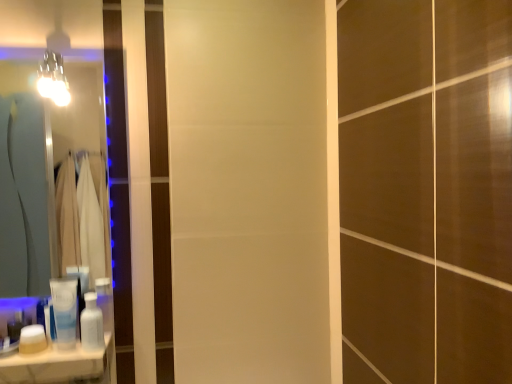
Question: From their relative heights in the image, would you say white glossy lotion at lower left, which is the second toiletry from right to left, is taller or shorter than white matte jar at lower left, marked as the first toiletry in a left-to-right arrangement?

Choices:
 (A) tall
 (B) short

Answer: (A)

Question: Which is correct: white glossy lotion at lower left, which is the second toiletry from right to left, is inside white matte jar at lower left, positioned as the third toiletry in right-to-left order, or outside of it?

Choices:
 (A) outside
 (B) inside

Answer: (A)

Question: Which object is positioned closest to the white glossy counter top at lower left?

Choices:
 (A) white glossy lotion at lower left, placed as the 2th toiletry when sorted from left to right
 (B) matte glass mirror at left
 (C) white glossy bottle at lower left, the first toiletry viewed from the right
 (D) white matte jar at lower left, positioned as the third toiletry in right-to-left order
 (E) metallic glass light fixture at upper left

Answer: (A)

Question: Which of these objects is positioned closest to the white matte jar at lower left, marked as the first toiletry in a left-to-right arrangement?

Choices:
 (A) matte glass mirror at left
 (B) metallic glass light fixture at upper left
 (C) white glossy lotion at lower left, which is the second toiletry from right to left
 (D) white glossy counter top at lower left
 (E) white glossy bottle at lower left, the first toiletry viewed from the right

Answer: (D)